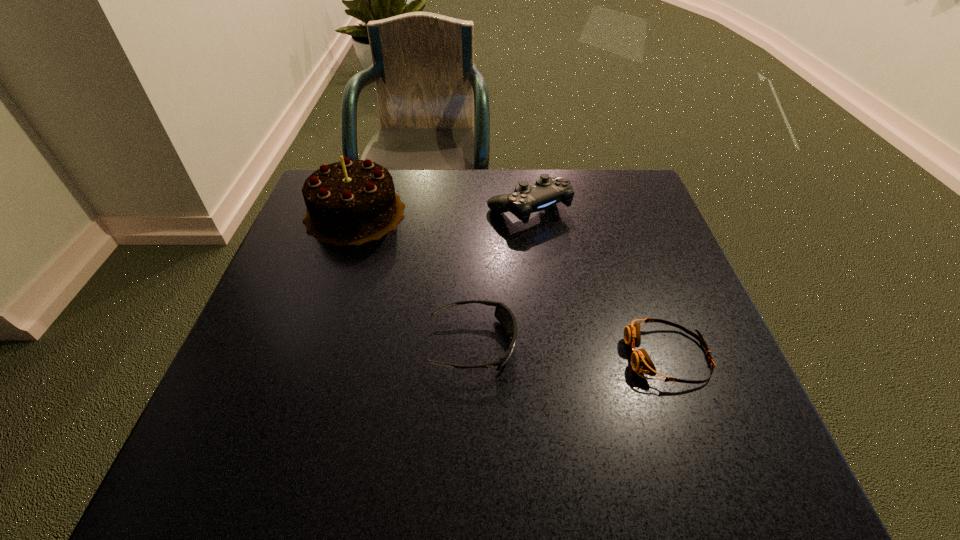
In the image, there is a desktop. Where is `vacant space at the right edge`? vacant space at the right edge is located at coordinates (642, 260).

I want to click on vacant space at the far right corner of the desktop, so click(x=605, y=210).

The height and width of the screenshot is (540, 960). What are the coordinates of `unoccupied position between the birthday cake and the shorter goggles` in the screenshot? It's located at (512, 285).

The height and width of the screenshot is (540, 960). I want to click on vacant space in between the shortest object and the left goggles, so click(x=570, y=350).

Where is `empty space that is in between the second tallest object and the birthday cake`? empty space that is in between the second tallest object and the birthday cake is located at coordinates (442, 211).

Find the location of a particular element. Image resolution: width=960 pixels, height=540 pixels. vacant space that is in between the leftmost object and the rightmost object is located at coordinates (512, 285).

Where is `unoccupied position between the left goggles and the leftmost object`? This screenshot has width=960, height=540. unoccupied position between the left goggles and the leftmost object is located at coordinates (414, 279).

The height and width of the screenshot is (540, 960). What are the coordinates of `free area in between the control and the left goggles` in the screenshot? It's located at (501, 276).

What are the coordinates of `vacant space that is in between the tallest object and the control` in the screenshot? It's located at (442, 211).

The image size is (960, 540). Identify the location of vacant area between the leftmost object and the control. coord(442,211).